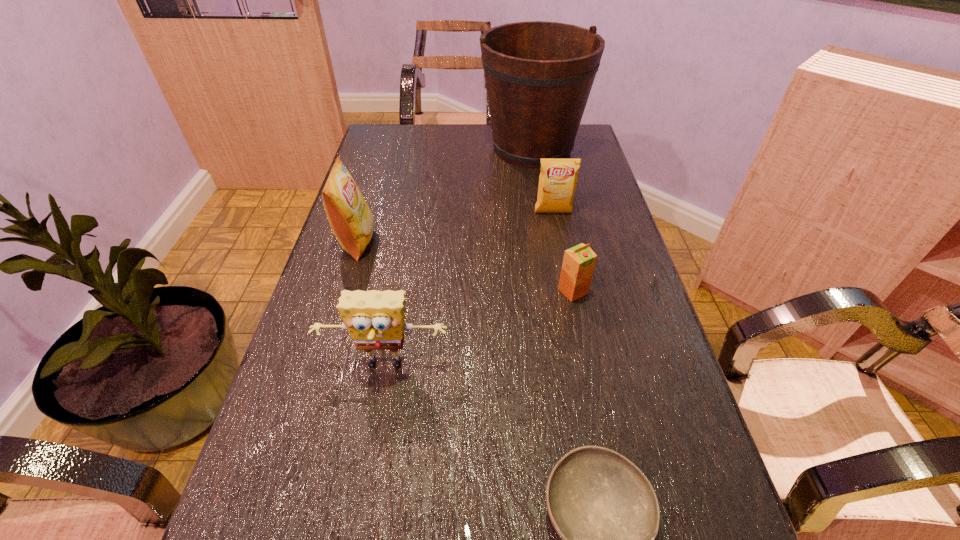
I want to click on bucket, so click(x=538, y=75).

Find the location of `the farthest object`. the farthest object is located at coordinates (538, 75).

Where is `the third farthest object`? Image resolution: width=960 pixels, height=540 pixels. the third farthest object is located at coordinates (352, 222).

Find the location of a particular element. The width and height of the screenshot is (960, 540). the nearer crisp (potato chip) is located at coordinates (352, 222).

Where is `the second nearest object`? The width and height of the screenshot is (960, 540). the second nearest object is located at coordinates (375, 319).

Locate an element on the screen. the shorter crisp (potato chip) is located at coordinates tap(557, 182).

The width and height of the screenshot is (960, 540). I want to click on the farther crisp (potato chip), so click(557, 182).

Identify the location of orange juice. (579, 261).

Find the location of a particular element. Image resolution: width=960 pixels, height=540 pixels. the second shortest object is located at coordinates (579, 261).

Identify the location of vacant space located 0.120m on the front of the tallest object. (540, 199).